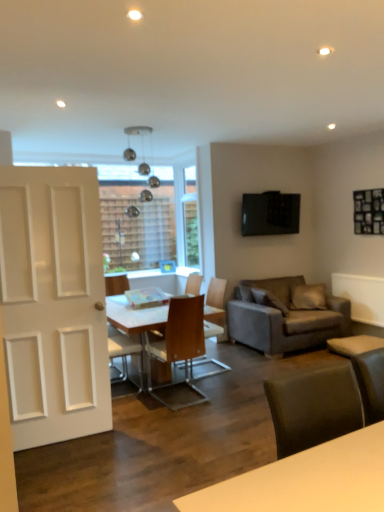
Where is `vacant area that is in front of white matte door at left`? vacant area that is in front of white matte door at left is located at coordinates (70, 471).